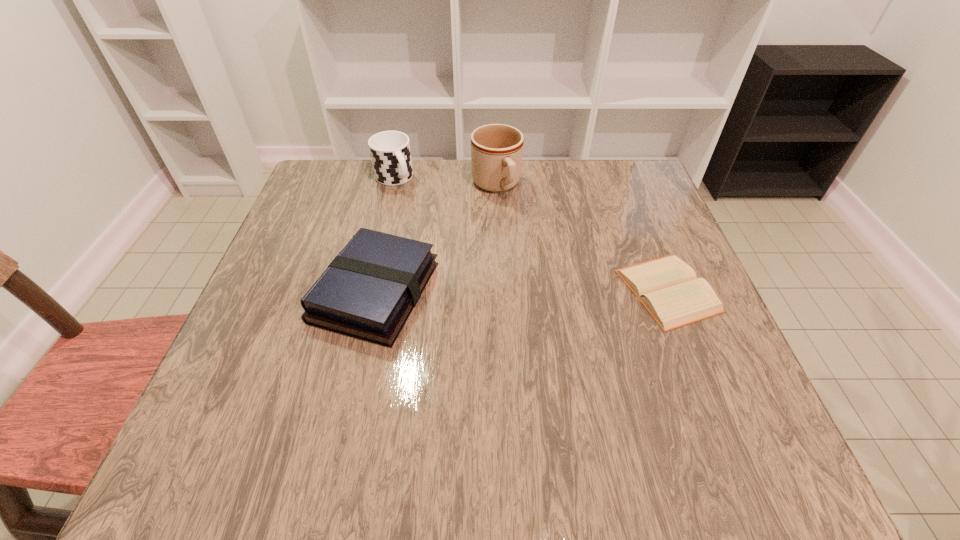
I want to click on the second shortest object, so click(368, 291).

Identify the location of the shortest object. The width and height of the screenshot is (960, 540). (667, 287).

The image size is (960, 540). Identify the location of diary. (667, 287).

Where is `the third object from left to right`? This screenshot has height=540, width=960. the third object from left to right is located at coordinates (496, 149).

Image resolution: width=960 pixels, height=540 pixels. I want to click on the tallest object, so click(x=496, y=149).

Where is `cup`? cup is located at coordinates (390, 152).

Where is `vacant space located on the back of the book`? vacant space located on the back of the book is located at coordinates (396, 199).

You are a GUI agent. You are given a task and a screenshot of the screen. Output one action in this format:
    pyautogui.click(x=<x>, y=<y>)
    Task: Click on the blank area located on the back of the rightmost object
    The image size is (960, 540).
    Given the screenshot: What is the action you would take?
    pyautogui.click(x=629, y=192)

Identify the location of free point located on the side of the tallest object with the handle. The image size is (960, 540). (541, 267).

The image size is (960, 540). Identify the location of free space located on the side of the tallest object with the handle. click(x=523, y=235).